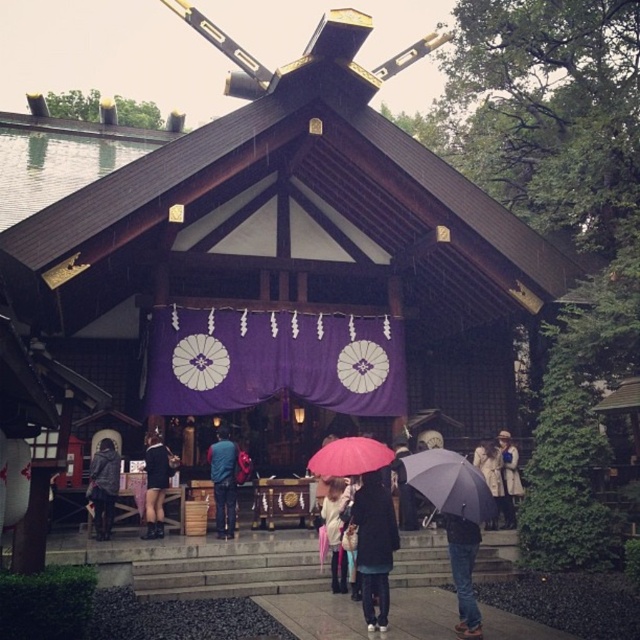
Question: Which object appears farthest from the camera in this image?

Choices:
 (A) blue denim jacket at center
 (B) white cotton scarf at center
 (C) jeans at lower right
 (D) black matte umbrella at lower center

Answer: (A)

Question: Observing the image, what is the correct spatial positioning of pink matte umbrella at center in reference to dark gray fabric jacket at lower left?

Choices:
 (A) left
 (B) right

Answer: (B)

Question: In this image, where is jeans at lower right located relative to black leather shorts at center?

Choices:
 (A) right
 (B) left

Answer: (A)

Question: Which object is farther from the camera taking this photo?

Choices:
 (A) dark blue fabric umbrella at center
 (B) pink matte umbrella at center
 (C) dark gray fabric umbrella at center

Answer: (A)

Question: Which point is closer to the camera taking this photo?

Choices:
 (A) (385, 500)
 (B) (400, 484)

Answer: (A)

Question: Can you confirm if dark gray fabric jacket at lower left is positioned above dark blue fabric umbrella at center?

Choices:
 (A) yes
 (B) no

Answer: (A)